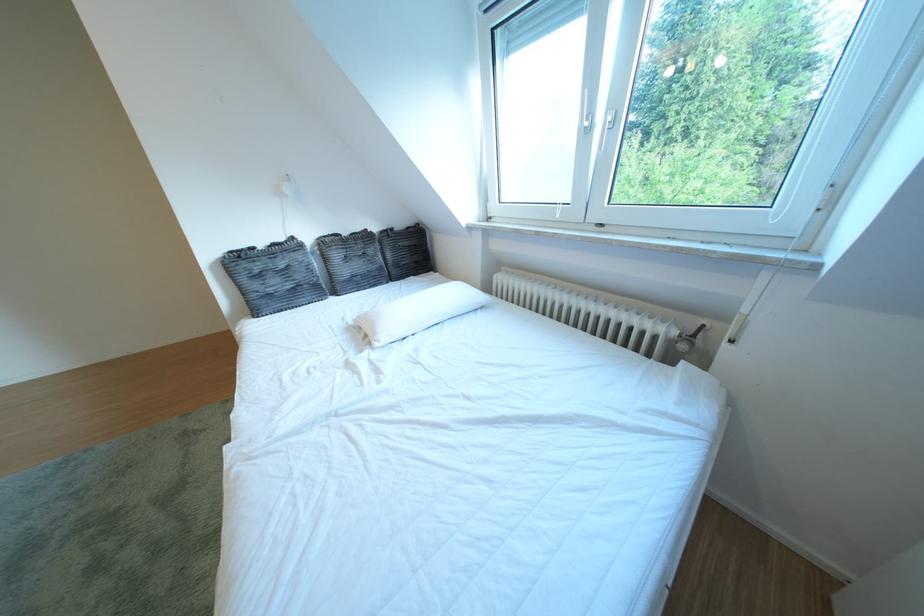
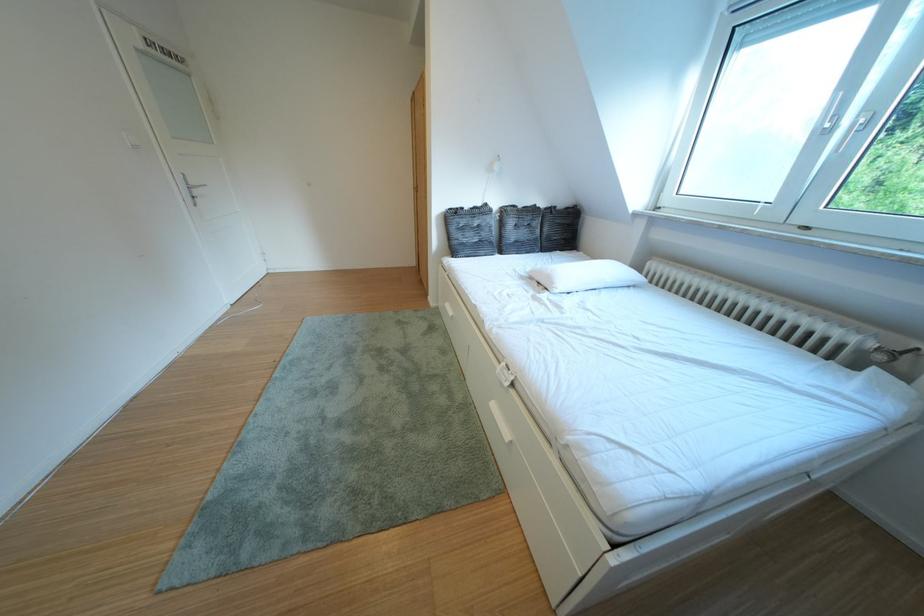
In the second image, find the point that corresponds to point 268,301 in the first image.

(468, 246)